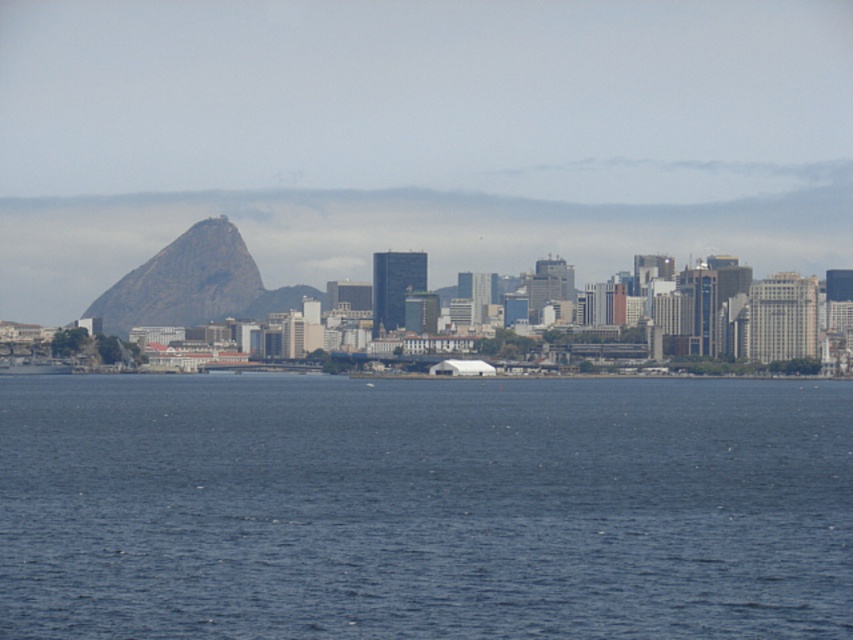
Question: Is blue water at center to the left of rocky gray mountain at left from the viewer's perspective?

Choices:
 (A) yes
 (B) no

Answer: (B)

Question: Where is blue water at center located in relation to rocky gray mountain at left in the image?

Choices:
 (A) above
 (B) below

Answer: (B)

Question: In this image, where is blue water at center located relative to rocky gray mountain at left?

Choices:
 (A) left
 (B) right

Answer: (B)

Question: Which point is closer to the camera?

Choices:
 (A) rocky gray mountain at left
 (B) blue water at center

Answer: (B)